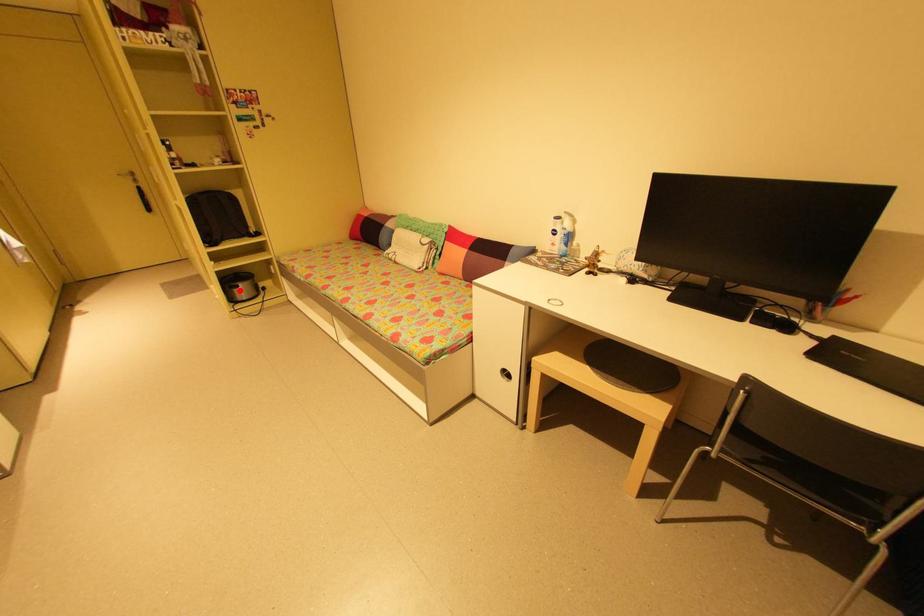
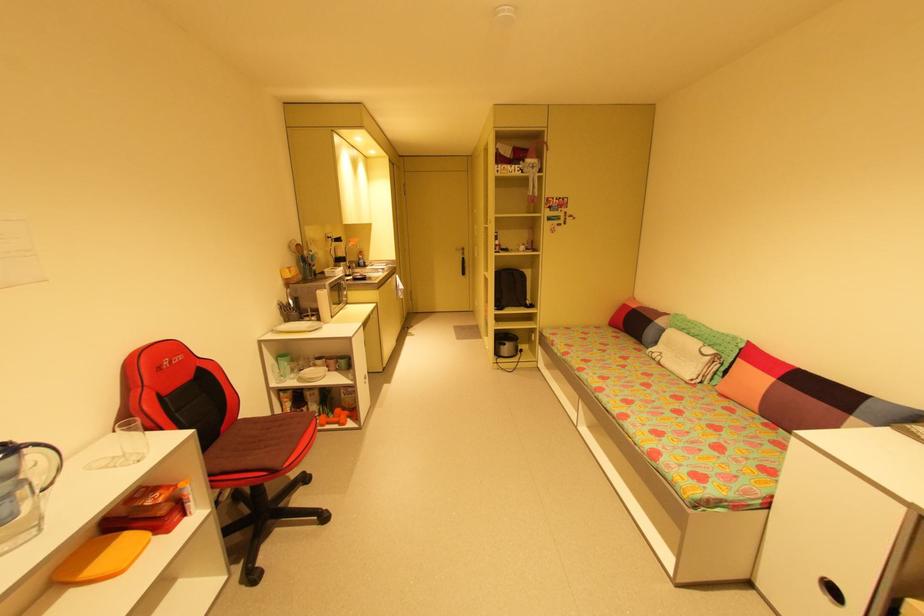
Question: I am providing you with two images of the same scene from different viewpoints. Given a red point in image1, look at the same physical point in image2. Is it:

Choices:
 (A) Closer to the viewpoint
 (B) Farther from the viewpoint

Answer: (B)